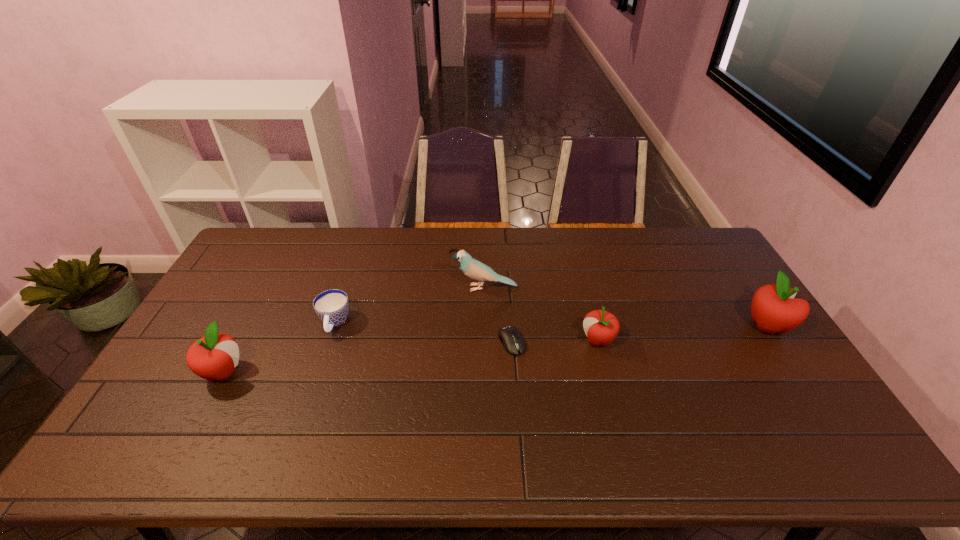
Identify the location of free location located 0.110m on the right of the second apple from left to right. (652, 341).

You are a GUI agent. You are given a task and a screenshot of the screen. Output one action in this format:
    pyautogui.click(x=<x>, y=<y>)
    Task: Click on the vacant space located 0.110m on the back of the rightmost object
    Image resolution: width=960 pixels, height=540 pixels.
    Given the screenshot: What is the action you would take?
    pyautogui.click(x=741, y=287)

Identify the location of vacant area located 0.390m at the face of the farthest object. (335, 288).

The image size is (960, 540). Identify the location of vacant region located 0.280m at the face of the farthest object. (368, 288).

The width and height of the screenshot is (960, 540). What are the coordinates of `vacant space located 0.170m at the face of the farthest object` in the screenshot? It's located at (400, 288).

Find the location of `free region located on the right of the shortest object`. free region located on the right of the shortest object is located at coordinates coord(586,342).

Locate an element on the screen. The image size is (960, 540). free space located on the side of the cup with the handle is located at coordinates (321, 364).

You are a GUI agent. You are given a task and a screenshot of the screen. Output one action in this format:
    pyautogui.click(x=<x>, y=<y>)
    Task: Click on the object that is at the left edge
    This screenshot has height=540, width=960.
    Given the screenshot: What is the action you would take?
    pyautogui.click(x=213, y=357)

Locate an element on the screen. The height and width of the screenshot is (540, 960). object present at the right edge is located at coordinates (773, 308).

This screenshot has width=960, height=540. I want to click on free space at the far edge of the desktop, so click(372, 230).